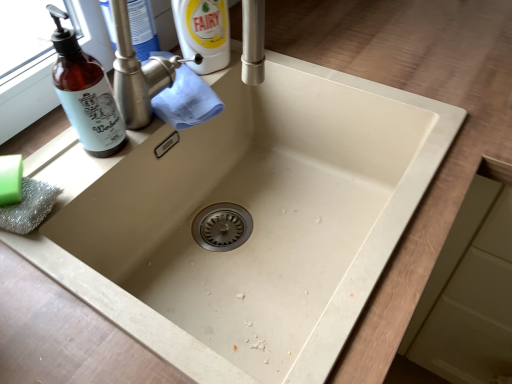
Question: Does brushed metal tap at upper center have a smaller size compared to green matte soap at lower left?

Choices:
 (A) no
 (B) yes

Answer: (A)

Question: Is brushed metal tap at upper center positioned in front of green matte soap at lower left?

Choices:
 (A) yes
 (B) no

Answer: (B)

Question: Is brushed metal tap at upper center at the left side of green matte soap at lower left?

Choices:
 (A) yes
 (B) no

Answer: (B)

Question: Considering the relative sizes of brushed metal tap at upper center and green matte soap at lower left in the image provided, is brushed metal tap at upper center thinner than green matte soap at lower left?

Choices:
 (A) yes
 (B) no

Answer: (B)

Question: From the image's perspective, does brushed metal tap at upper center appear higher than green matte soap at lower left?

Choices:
 (A) no
 (B) yes

Answer: (B)

Question: Can you see brushed metal tap at upper center touching green matte soap at lower left?

Choices:
 (A) yes
 (B) no

Answer: (B)

Question: Considering the relative positions of brown glass bottle at left and brushed metal tap at upper center in the image provided, is brown glass bottle at left to the left of brushed metal tap at upper center from the viewer's perspective?

Choices:
 (A) yes
 (B) no

Answer: (A)

Question: Can you confirm if brown glass bottle at left is taller than brushed metal tap at upper center?

Choices:
 (A) yes
 (B) no

Answer: (A)

Question: From a real-world perspective, is brown glass bottle at left located beneath brushed metal tap at upper center?

Choices:
 (A) yes
 (B) no

Answer: (B)

Question: Does brown glass bottle at left turn towards brushed metal tap at upper center?

Choices:
 (A) no
 (B) yes

Answer: (A)

Question: Is brown glass bottle at left positioned with its back to brushed metal tap at upper center?

Choices:
 (A) no
 (B) yes

Answer: (A)

Question: Does brown glass bottle at left have a greater width compared to brushed metal tap at upper center?

Choices:
 (A) yes
 (B) no

Answer: (B)

Question: Does green matte soap at lower left contain brown glass bottle at left?

Choices:
 (A) no
 (B) yes

Answer: (A)